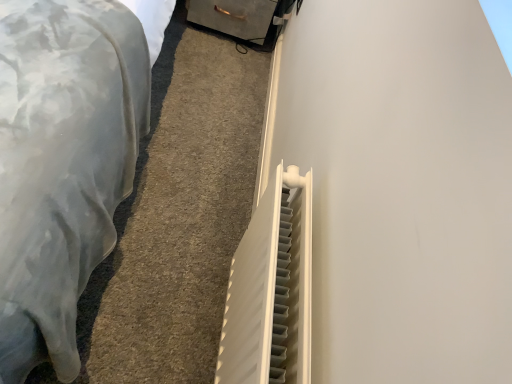
Where is `free spot above white plastic radiator at lower right (from a real-world perspective)`? This screenshot has height=384, width=512. free spot above white plastic radiator at lower right (from a real-world perspective) is located at coordinates (179, 150).